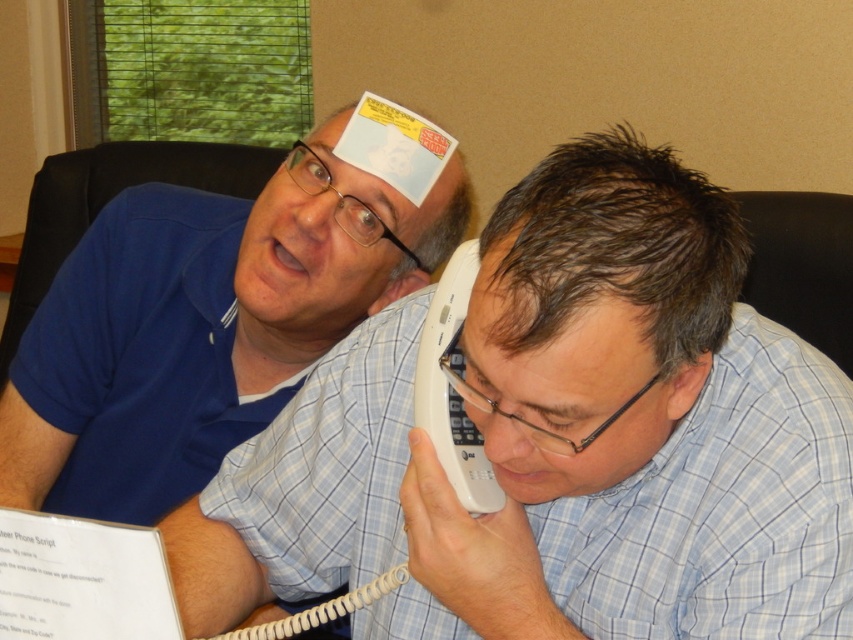
Can you confirm if blue shirt at upper left is positioned below matte blue shirt at upper left?

Yes, blue shirt at upper left is below matte blue shirt at upper left.

Between point (285, 529) and point (64, 456), which one is positioned behind?

Positioned behind is point (64, 456).

The image size is (853, 640). What are the coordinates of `blue shirt at upper left` in the screenshot? It's located at (560, 442).